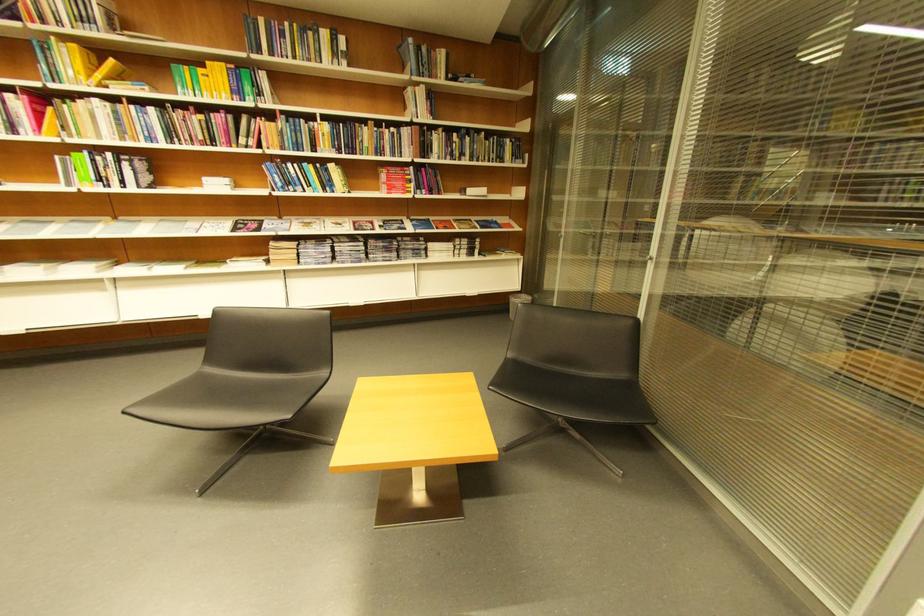
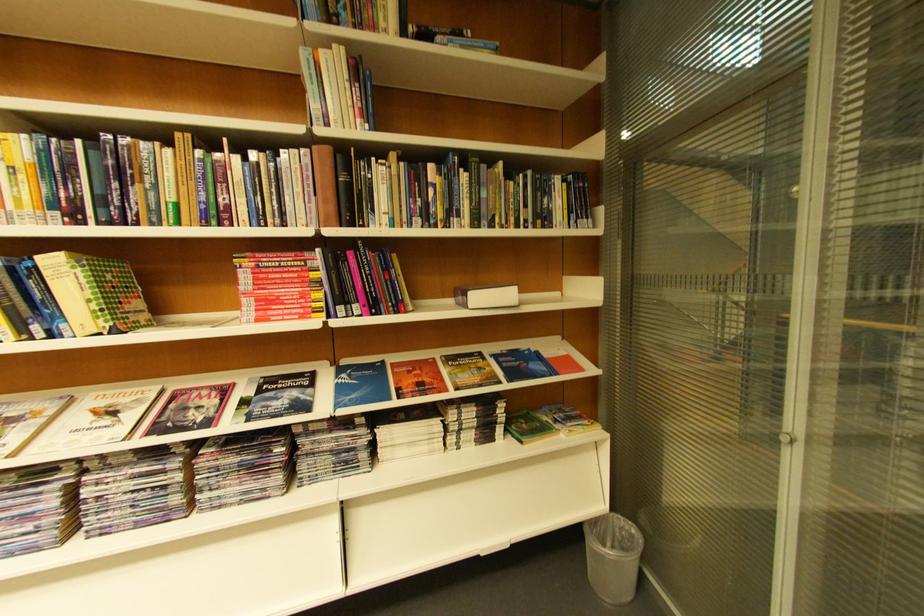
Question: I am providing you with two images of the same scene from different viewpoints. Which of the following objects are not visible in image2?

Choices:
 (A) green spine book
 (B) small white box
 (C) Forschung magazine
 (D) none of these

Answer: (D)